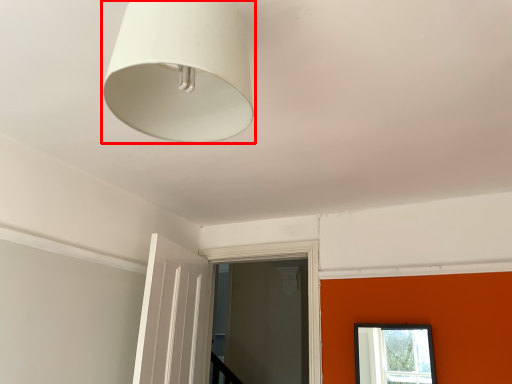
Question: From the image's perspective, what is the correct spatial relationship of lamp (annotated by the red box) in relation to window frame?

Choices:
 (A) below
 (B) above

Answer: (B)